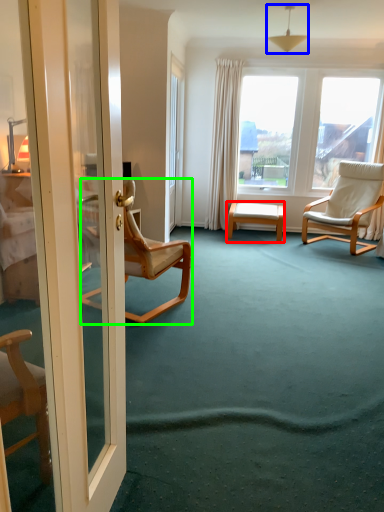
Question: Considering the real-world distances, which object is farthest from table (highlighted by a red box)? lamp (highlighted by a blue box) or chair (highlighted by a green box)?

Choices:
 (A) lamp
 (B) chair

Answer: (A)